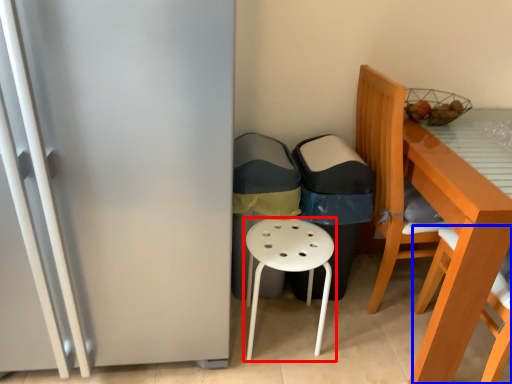
Question: Which object appears farthest to the camera in this image, stool (highlighted by a red box) or chair (highlighted by a blue box)?

Choices:
 (A) stool
 (B) chair

Answer: (A)